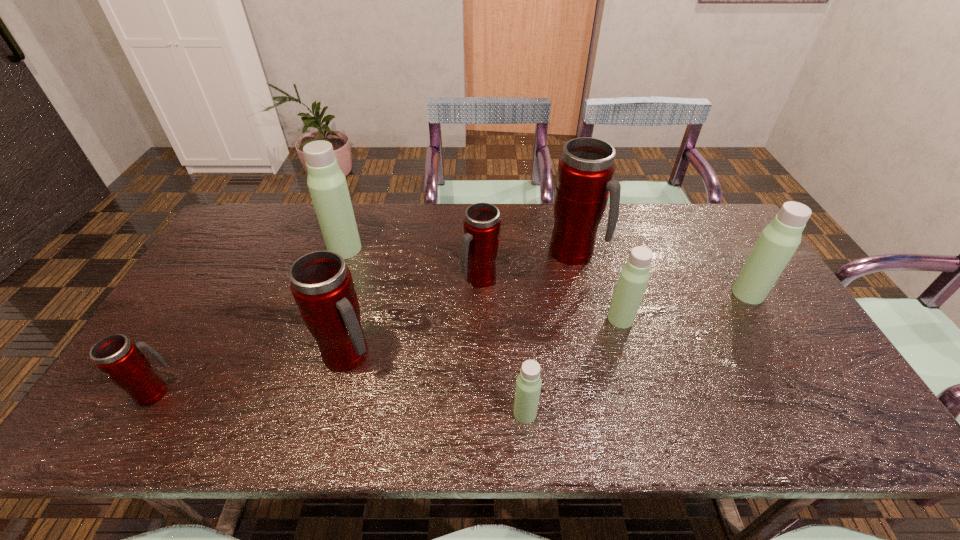
Identify the location of vacant space that is in between the second nearest light thermos bottle and the third smallest red thermos bottle. (485, 337).

Identify the location of blank region between the third light thermos bottle from right to left and the fourth thermos bottle from left to right. (503, 346).

In order to click on the fifth closest object relative to the leftmost red thermos bottle in this screenshot , I will do `click(586, 169)`.

Identify which object is the fifth closest to the third light thermos bottle from right to left. Please provide its 2D coordinates. Your answer should be formatted as a tuple, i.e. [(x, y)], where the tuple contains the x and y coordinates of a point satisfying the conditions above.

[(778, 241)]

Identify which thermos bottle is the sixth nearest to the biggest light thermos bottle. Please provide its 2D coordinates. Your answer should be formatted as a tuple, i.e. [(x, y)], where the tuple contains the x and y coordinates of a point satisfying the conditions above.

[(634, 276)]

Identify which thermos bottle is the fifth closest to the third nearest light thermos bottle. Please provide its 2D coordinates. Your answer should be formatted as a tuple, i.e. [(x, y)], where the tuple contains the x and y coordinates of a point satisfying the conditions above.

[(322, 286)]

The width and height of the screenshot is (960, 540). Identify the location of light thermos bottle that is the third closest to the biggest red thermos bottle. (528, 384).

Image resolution: width=960 pixels, height=540 pixels. Identify the location of light thermos bottle that can be found as the fourth closest to the second smallest red thermos bottle. (778, 241).

I want to click on the closest red thermos bottle to the second nearest light thermos bottle, so click(x=586, y=169).

Point out which red thermos bottle is positioned as the fourth nearest to the biggest light thermos bottle. Please provide its 2D coordinates. Your answer should be formatted as a tuple, i.e. [(x, y)], where the tuple contains the x and y coordinates of a point satisfying the conditions above.

[(586, 169)]